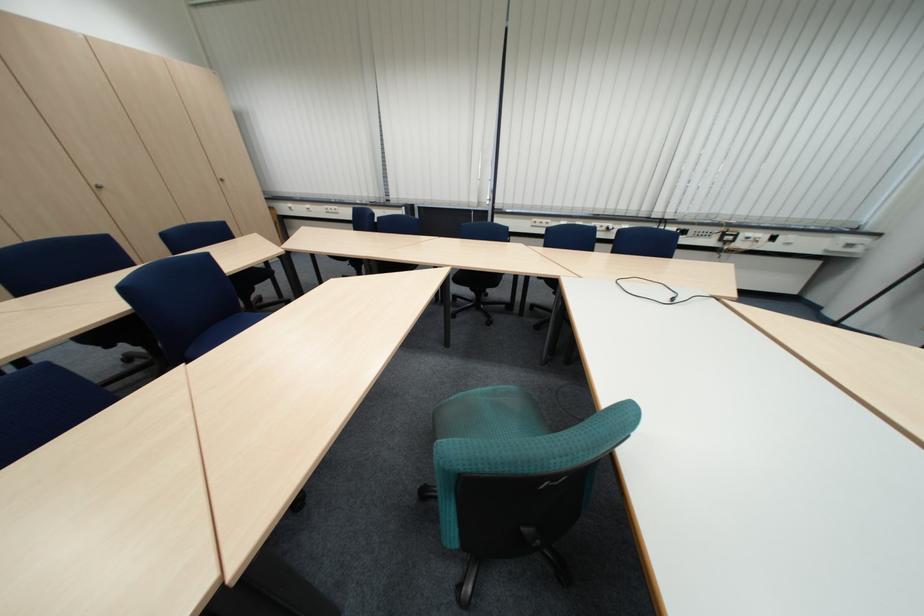
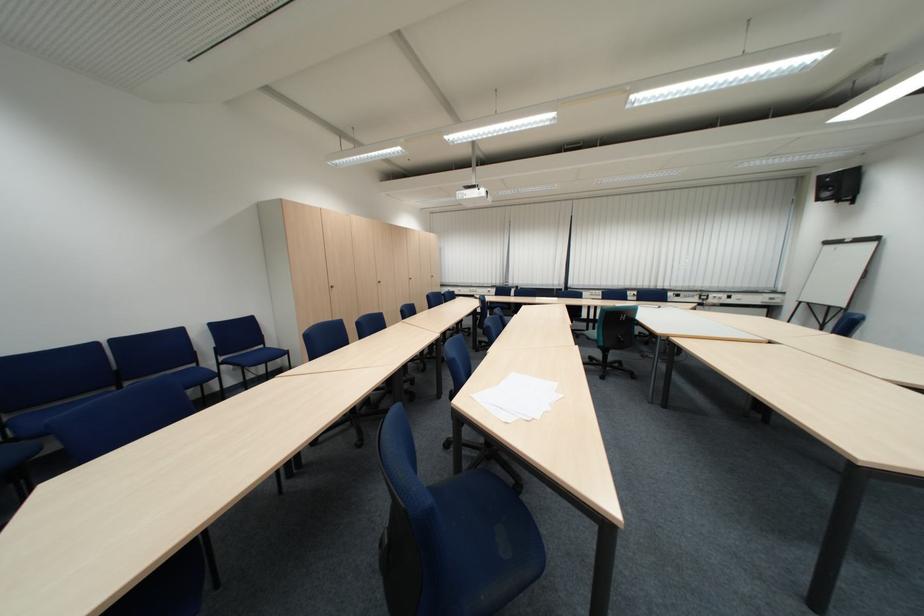
What movement of the cameraman would produce the second image?

The cameraman walked toward left, backward.